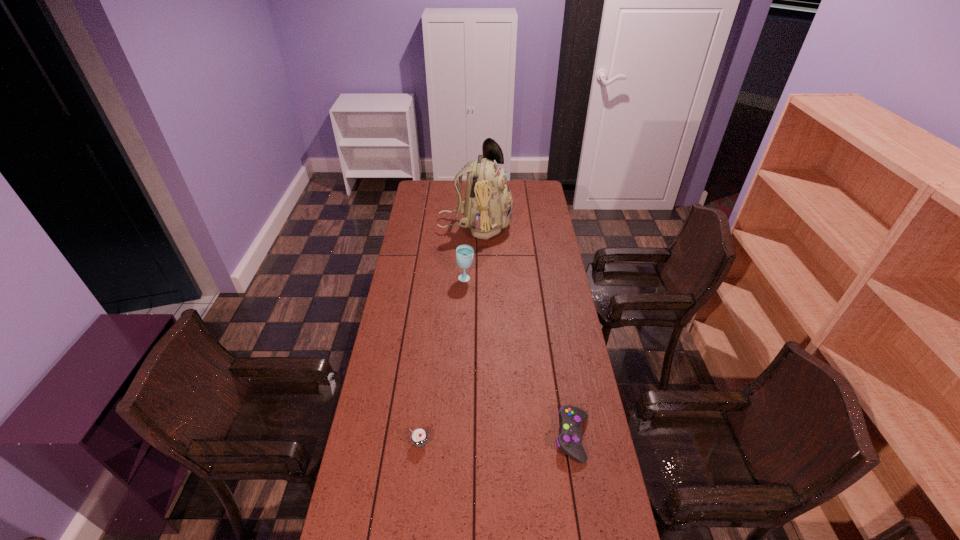
The height and width of the screenshot is (540, 960). I want to click on vacant space that is in between the shortest object and the backpack, so click(x=524, y=332).

Locate an element on the screen. Image resolution: width=960 pixels, height=540 pixels. unoccupied position between the farthest object and the cupcake is located at coordinates (447, 334).

You are a GUI agent. You are given a task and a screenshot of the screen. Output one action in this format:
    pyautogui.click(x=<x>, y=<y>)
    Task: Click on the free space between the farthest object and the rightmost object
    
    Given the screenshot: What is the action you would take?
    (x=524, y=332)

Where is `object identified as the third closest to the second shortest object`? The width and height of the screenshot is (960, 540). object identified as the third closest to the second shortest object is located at coordinates (487, 208).

Find the location of a particular element. The height and width of the screenshot is (540, 960). object that stands as the third closest to the backpack is located at coordinates (419, 437).

In order to click on free spot that satisfies the following two spatial constraints: 1. on the back side of the third tallest object; 2. on the right side of the glass in this screenshot , I will do `click(438, 279)`.

Identify the location of vacant point that satisfies the following two spatial constraints: 1. on the back side of the cupcake; 2. on the left side of the shortest object. Image resolution: width=960 pixels, height=540 pixels. (420, 437).

Locate an element on the screen. vacant region that satisfies the following two spatial constraints: 1. on the back side of the cupcake; 2. on the left side of the third nearest object is located at coordinates (438, 279).

This screenshot has height=540, width=960. I want to click on vacant space that satisfies the following two spatial constraints: 1. on the front-facing side of the backpack; 2. on the front side of the second farthest object, so click(474, 279).